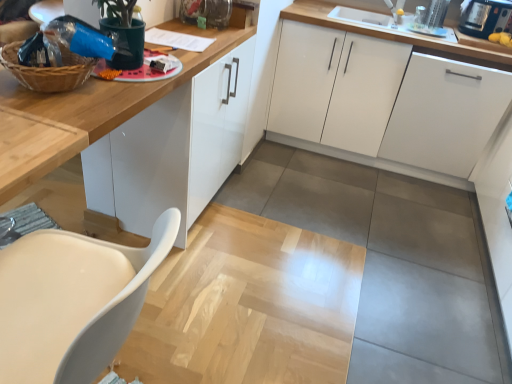
Question: Is point (434, 77) closer or farther from the camera than point (479, 14)?

Choices:
 (A) farther
 (B) closer

Answer: (B)

Question: Considering their positions, is white matte cabinet at right, the third cabinetry viewed from the left, located in front of or behind black plastic toaster at upper right?

Choices:
 (A) behind
 (B) front

Answer: (B)

Question: Based on their relative distances, which object is farther from the white matte cabinet at right, the third cabinetry viewed from the left?

Choices:
 (A) woven brown basket at upper left
 (B) white matte cabinet at center, which is the second cabinetry in left-to-right order
 (C) white glossy cabinet at upper center, the 3th cabinetry when ordered from right to left
 (D) black plastic toaster at upper right
 (E) white matte chair at lower left

Answer: (E)

Question: Estimate the real-world distances between objects in this image. Which object is farther from the woven brown basket at upper left?

Choices:
 (A) white glossy cabinet at upper center, the 3th cabinetry when ordered from right to left
 (B) white matte chair at lower left
 (C) natural wood table at left
 (D) black plastic toaster at upper right
 (E) white matte cabinet at center, which is the second cabinetry in left-to-right order

Answer: (D)